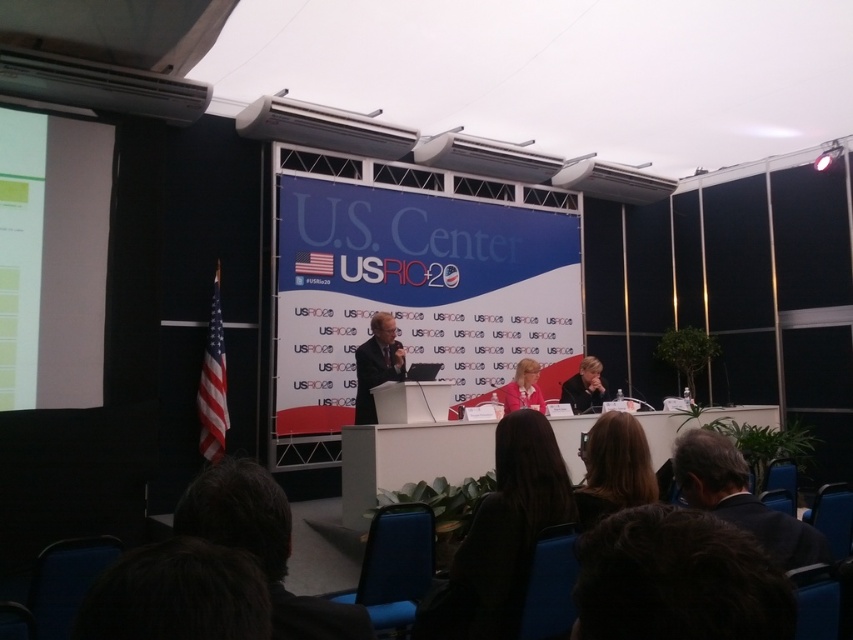
Is dark blue suit at lower right below dark suit at center?

Correct, dark blue suit at lower right is located below dark suit at center.

Image resolution: width=853 pixels, height=640 pixels. What do you see at coordinates (740, 499) in the screenshot?
I see `dark blue suit at lower right` at bounding box center [740, 499].

Which is in front, point (746, 497) or point (384, 371)?

Point (746, 497)

Where is `dark blue suit at lower right`? This screenshot has width=853, height=640. dark blue suit at lower right is located at coordinates (740, 499).

Which of these two, dark brown hair at lower center or dark suit at center, stands shorter?

With less height is dark brown hair at lower center.

Who is lower down, dark brown hair at lower center or dark suit at center?

dark brown hair at lower center is below.

Locate an element on the screen. Image resolution: width=853 pixels, height=640 pixels. dark brown hair at lower center is located at coordinates (613, 468).

This screenshot has height=640, width=853. I want to click on dark brown hair at lower center, so click(x=613, y=468).

Who is more forward, [390,358] or [543,404]?

Point [390,358]

Where is `dark suit at center`? Image resolution: width=853 pixels, height=640 pixels. dark suit at center is located at coordinates (376, 364).

Identify the location of dark suit at center. pos(376,364).